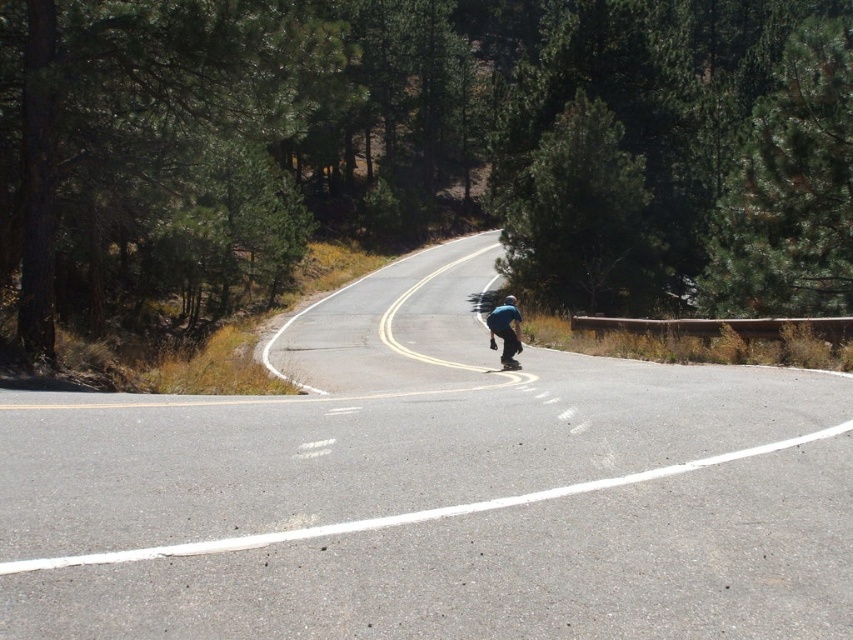
Between point (567, 198) and point (519, 369), which one is positioned behind?

Positioned behind is point (567, 198).

Between green leafy tree at upper center and black smooth skateboard at center, which one appears on the right side from the viewer's perspective?

Positioned to the right is green leafy tree at upper center.

Describe the element at coordinates (581, 216) in the screenshot. I see `green leafy tree at upper center` at that location.

This screenshot has height=640, width=853. Identify the location of green leafy tree at upper center. (581, 216).

Can you confirm if green leafy tree at upper center is shorter than blue matte skateboard at center?

In fact, green leafy tree at upper center may be taller than blue matte skateboard at center.

I want to click on green leafy tree at upper center, so click(x=581, y=216).

Can you confirm if green leafy tree at left is wider than green textured pine tree at upper right?

No.

Can you confirm if green leafy tree at left is positioned below green textured pine tree at upper right?

Yes.

Between point (119, 13) and point (846, 202), which one is positioned behind?

Positioned behind is point (846, 202).

Identify the location of green leafy tree at left. This screenshot has width=853, height=640. (154, 150).